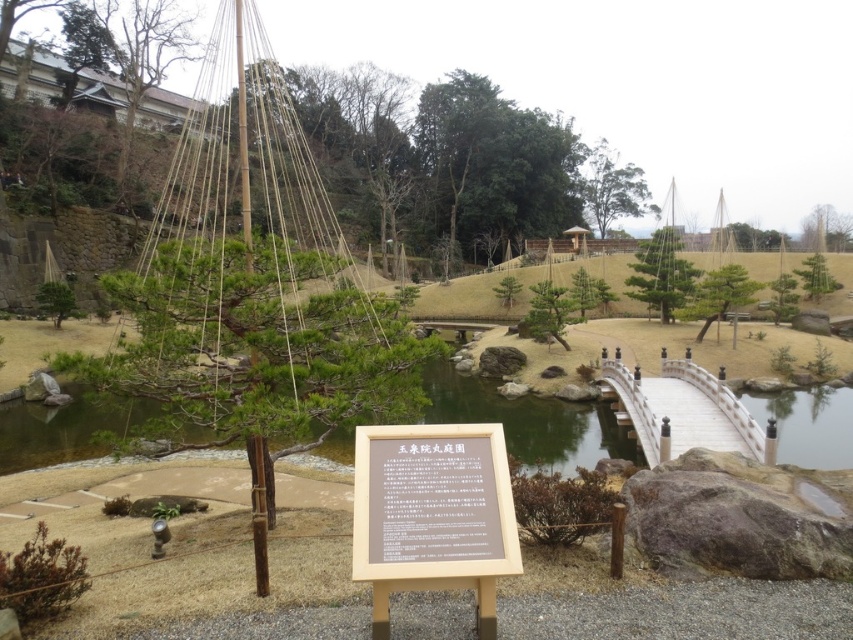
You are visiting a Japanese garden and see the green stone pond at center and the brown wooden sign at center. According to their positions, which object is located to the left?

The brown wooden sign at center is to the left of the green stone pond at center.

You are standing in the Japanese garden and want to take a photo of both the bonsai tree and the curved stone bridge. You notice two points marked in the scene. Which of the two points, point [780,460] or point [728,406], is closer to your camera position?

Point [728,406] is closer to the camera position because it is less further than point [780,460].

From the picture: You are a visitor walking along the path in the Japanese garden and see the green stone pond at center and the brown wooden sign at center. Which object is closer to you?

The green stone pond at center is closer to you because it is further to the viewer than the brown wooden sign at center.